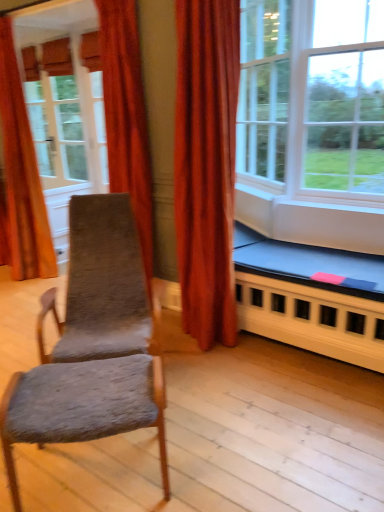
Image resolution: width=384 pixels, height=512 pixels. In order to click on blank space situated above blue fabric bed frame at lower right (from a real-world perspective) in this screenshot , I will do `click(301, 266)`.